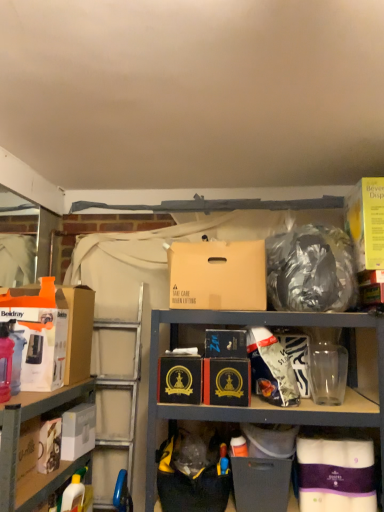
Question: From a real-world perspective, is black cardboard box at center, which is the third box from left to right, beneath yellow cardboard beverage dispenser at upper right, which appears as the 1th box when viewed from the right?

Choices:
 (A) yes
 (B) no

Answer: (A)

Question: Is black cardboard box at center, which appears as the 7th box when viewed from the right, positioned in front of yellow cardboard beverage dispenser at upper right, which ranks as the 9th box in left-to-right order?

Choices:
 (A) no
 (B) yes

Answer: (B)

Question: Is black cardboard box at center, which is the third box from left to right, taller than yellow cardboard beverage dispenser at upper right, which appears as the 1th box when viewed from the right?

Choices:
 (A) yes
 (B) no

Answer: (B)

Question: From a real-world perspective, is black cardboard box at center, which appears as the 7th box when viewed from the right, on yellow cardboard beverage dispenser at upper right, which ranks as the 9th box in left-to-right order?

Choices:
 (A) yes
 (B) no

Answer: (B)

Question: Can you confirm if black cardboard box at center, which appears as the 7th box when viewed from the right, is positioned to the left of yellow cardboard beverage dispenser at upper right, which ranks as the 9th box in left-to-right order?

Choices:
 (A) yes
 (B) no

Answer: (A)

Question: Looking at their shapes, would you say black cardboard box at center, which appears as the 7th box when viewed from the right, is wider or thinner than white matte toilet paper at lower right, positioned as the second box in right-to-left order?

Choices:
 (A) thin
 (B) wide

Answer: (B)

Question: Is black cardboard box at center, which is the third box from left to right, taller or shorter than white matte toilet paper at lower right, positioned as the second box in right-to-left order?

Choices:
 (A) short
 (B) tall

Answer: (A)

Question: Would you say black cardboard box at center, which appears as the 7th box when viewed from the right, is inside or outside white matte toilet paper at lower right, positioned as the second box in right-to-left order?

Choices:
 (A) outside
 (B) inside

Answer: (A)

Question: In terms of size, does black cardboard box at center, which is the third box from left to right, appear bigger or smaller than white matte toilet paper at lower right, marked as the 8th box in a left-to-right arrangement?

Choices:
 (A) small
 (B) big

Answer: (B)

Question: Is white cardboard box at lower left inside the boundaries of yellow plastic bottle at lower left, or outside?

Choices:
 (A) inside
 (B) outside

Answer: (B)

Question: Is point (28, 401) positioned closer to the camera than point (64, 489)?

Choices:
 (A) closer
 (B) farther

Answer: (A)

Question: Considering the positions of white cardboard box at lower left and yellow plastic bottle at lower left in the image, is white cardboard box at lower left taller or shorter than yellow plastic bottle at lower left?

Choices:
 (A) tall
 (B) short

Answer: (A)

Question: From a real-world perspective, is white cardboard box at lower left positioned above or below yellow plastic bottle at lower left?

Choices:
 (A) below
 (B) above

Answer: (B)

Question: From the image's perspective, is translucent plastic bottle at left above or below brown cardboard box at center, which is the 6th box in right-to-left order?

Choices:
 (A) below
 (B) above

Answer: (A)

Question: Which is correct: translucent plastic bottle at left is inside brown cardboard box at center, which is the fourth box in left-to-right order, or outside of it?

Choices:
 (A) outside
 (B) inside

Answer: (A)